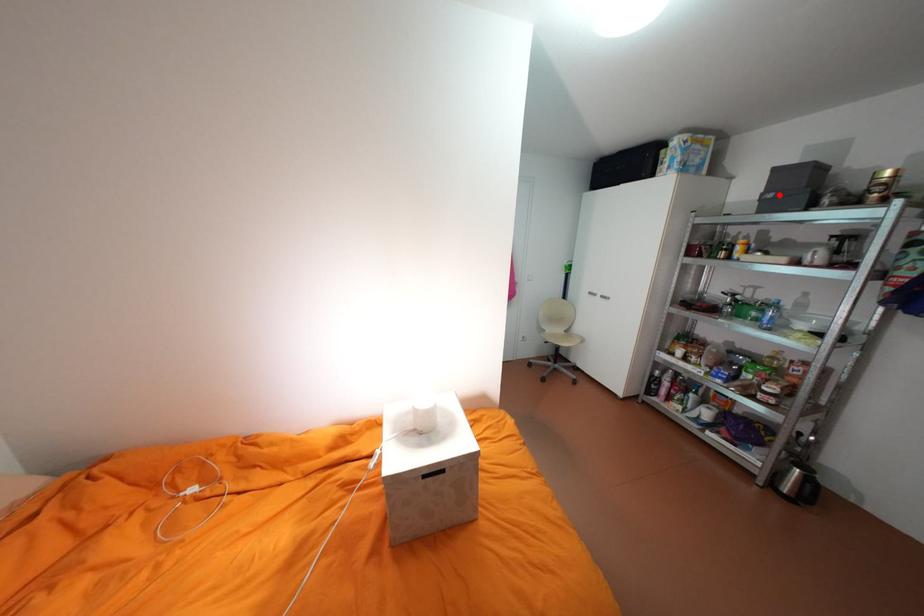
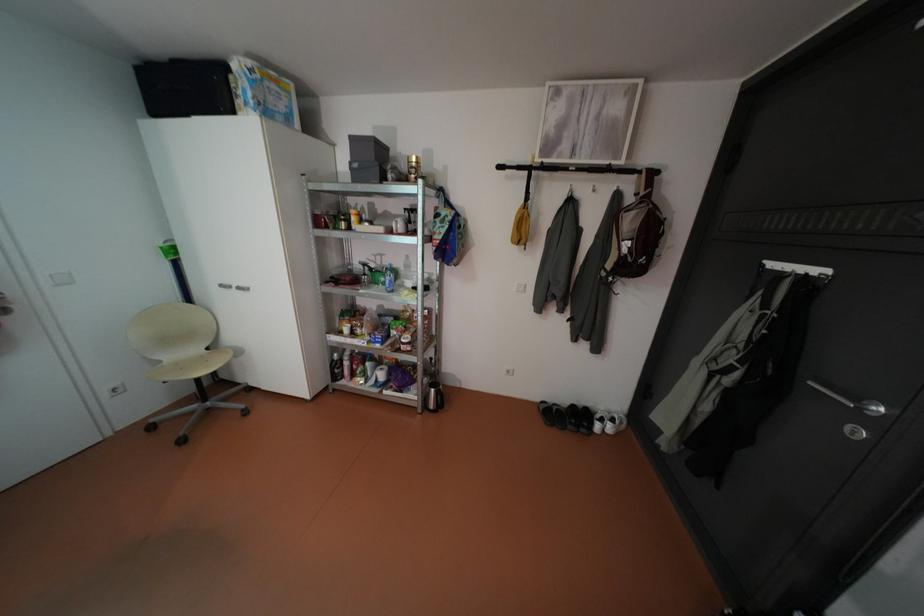
Find the pixel in the second image that matches the highlighted location in the first image.

(365, 164)